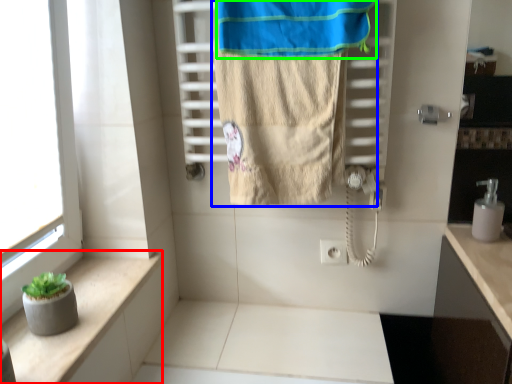
Question: Considering the real-world distances, which object is closest to balustrade (highlighted by a red box)? towel (highlighted by a blue box) or beach towel (highlighted by a green box).

Choices:
 (A) towel
 (B) beach towel

Answer: (A)